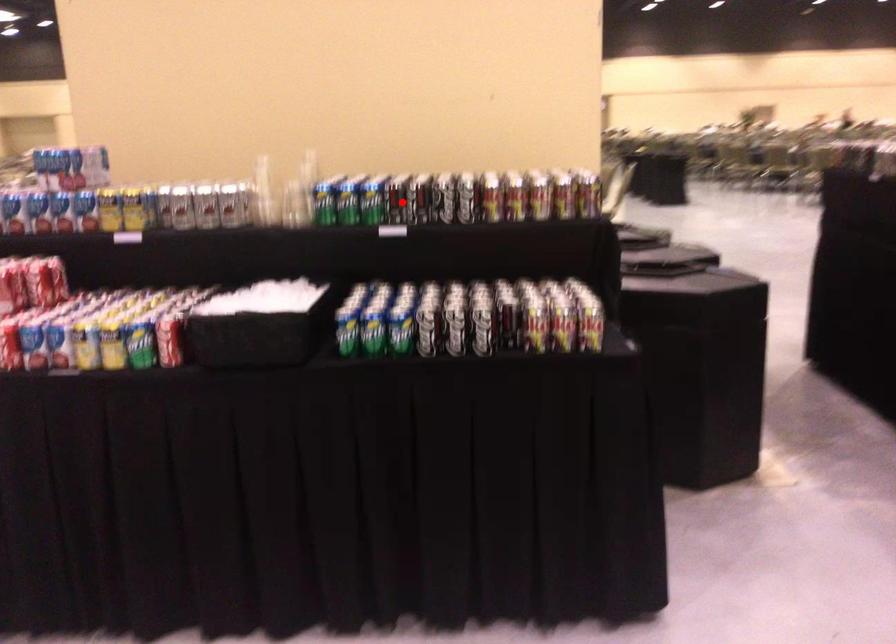
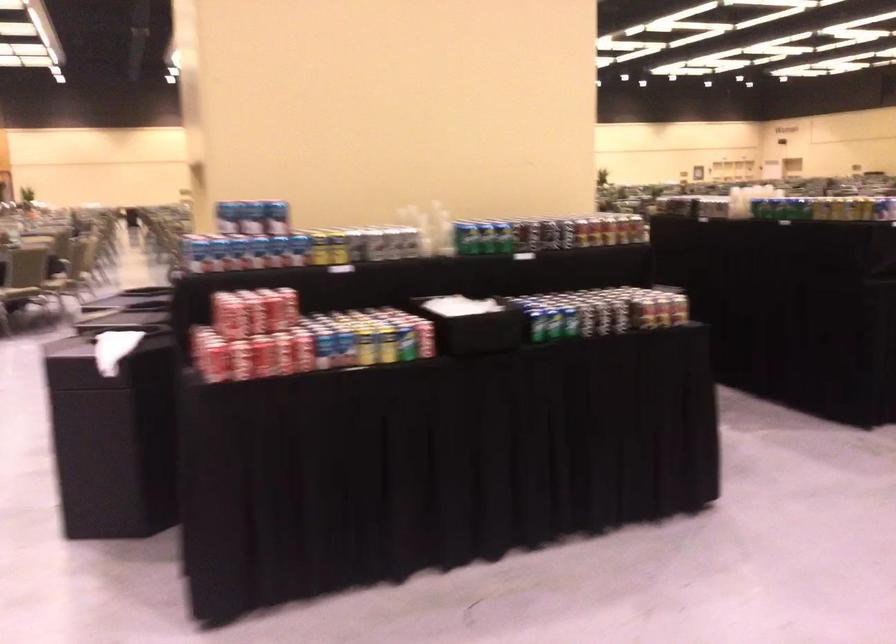
Where in the second image is the point corresponding to the highlighted location from the first image?

(530, 234)